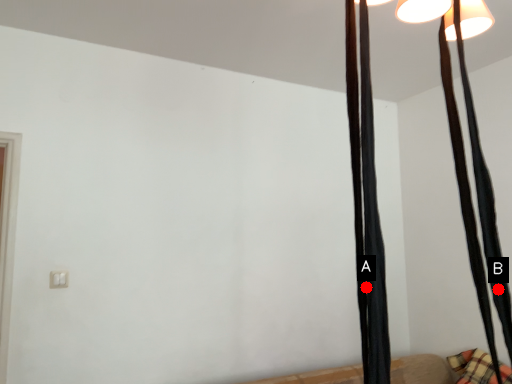
Question: Two points are circled on the image, labeled by A and B beside each circle. Which of the following is the farthest from the observer?

Choices:
 (A) A is further
 (B) B is further

Answer: (B)